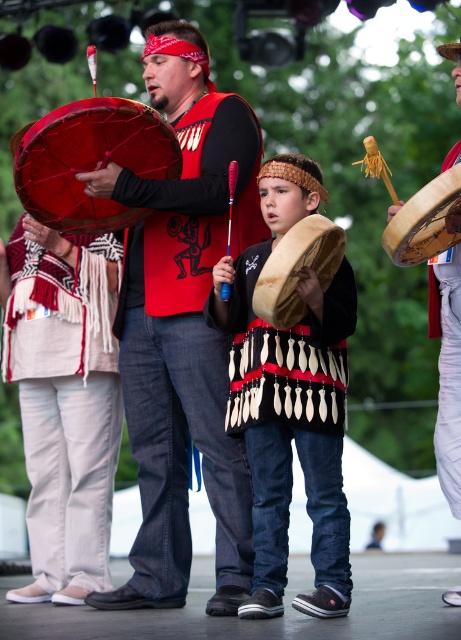
Who is positioned more to the right, white woven fabric at lower left or fur-like brown drum at center?

Positioned to the right is fur-like brown drum at center.

Which is behind, point (1, 282) or point (299, 262)?

The point (1, 282) is behind.

Image resolution: width=461 pixels, height=640 pixels. Identify the location of white woven fabric at lower left. (64, 401).

Can you confirm if velvet brown drum at center is positioned to the right of shiny red drum at center?

Correct, you'll find velvet brown drum at center to the right of shiny red drum at center.

Does velvet brown drum at center have a lesser width compared to shiny red drum at center?

Indeed, velvet brown drum at center has a lesser width compared to shiny red drum at center.

Describe the element at coordinates (290, 400) in the screenshot. The width and height of the screenshot is (461, 640). I see `velvet brown drum at center` at that location.

The height and width of the screenshot is (640, 461). I want to click on velvet brown drum at center, so click(x=290, y=400).

Between point (31, 196) and point (279, 300), which one is positioned in front?

Positioned in front is point (279, 300).

Between shiny red drum at center and fur-like brown drum at center, which one has less height?

fur-like brown drum at center is shorter.

Is point (87, 196) less distant than point (289, 236)?

No, it is not.

You are a GUI agent. You are given a task and a screenshot of the screen. Output one action in this format:
    pyautogui.click(x=<x>, y=<y>)
    Task: Click on the shiny red drum at center
    The image size is (461, 640).
    Given the screenshot: What is the action you would take?
    pyautogui.click(x=90, y=161)